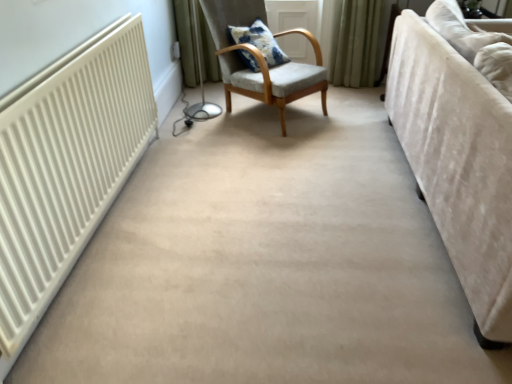
Question: Is light gray fabric chair at center further to the viewer compared to velvet beige couch at right?

Choices:
 (A) no
 (B) yes

Answer: (B)

Question: Could velvet beige couch at right be considered to be inside light gray fabric chair at center?

Choices:
 (A) yes
 (B) no

Answer: (B)

Question: Does light gray fabric chair at center have a greater height compared to velvet beige couch at right?

Choices:
 (A) no
 (B) yes

Answer: (B)

Question: Is light gray fabric chair at center aimed at velvet beige couch at right?

Choices:
 (A) no
 (B) yes

Answer: (B)

Question: Are light gray fabric chair at center and velvet beige couch at right beside each other?

Choices:
 (A) yes
 (B) no

Answer: (B)

Question: Considering their positions, is blue printed cushion at center located in front of or behind light gray fabric chair at center?

Choices:
 (A) front
 (B) behind

Answer: (B)

Question: Which is correct: blue printed cushion at center is inside light gray fabric chair at center, or outside of it?

Choices:
 (A) inside
 (B) outside

Answer: (A)

Question: In terms of width, does blue printed cushion at center look wider or thinner when compared to light gray fabric chair at center?

Choices:
 (A) wide
 (B) thin

Answer: (B)

Question: Is point (259, 66) closer or farther from the camera than point (241, 23)?

Choices:
 (A) farther
 (B) closer

Answer: (B)

Question: From the image's perspective, is light gray fabric chair at center located above or below velvet beige couch at right?

Choices:
 (A) below
 (B) above

Answer: (B)

Question: Choose the correct answer: Is light gray fabric chair at center inside velvet beige couch at right or outside it?

Choices:
 (A) inside
 (B) outside

Answer: (B)

Question: Is light gray fabric chair at center to the left or to the right of velvet beige couch at right in the image?

Choices:
 (A) right
 (B) left

Answer: (B)

Question: Looking at their shapes, would you say light gray fabric chair at center is wider or thinner than velvet beige couch at right?

Choices:
 (A) wide
 (B) thin

Answer: (B)

Question: In terms of size, does velvet beige couch at right appear bigger or smaller than blue printed cushion at center?

Choices:
 (A) small
 (B) big

Answer: (B)

Question: Is velvet beige couch at right in front of or behind blue printed cushion at center in the image?

Choices:
 (A) behind
 (B) front

Answer: (B)